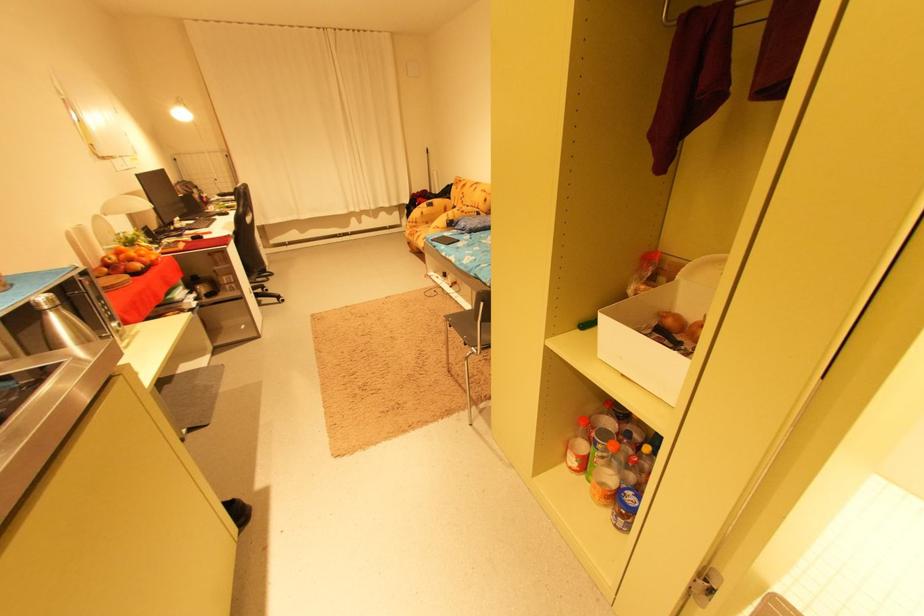
Find where to lift the green plastic bottle. Please return your answer as a coordinate pair (x, y).

(588, 323)